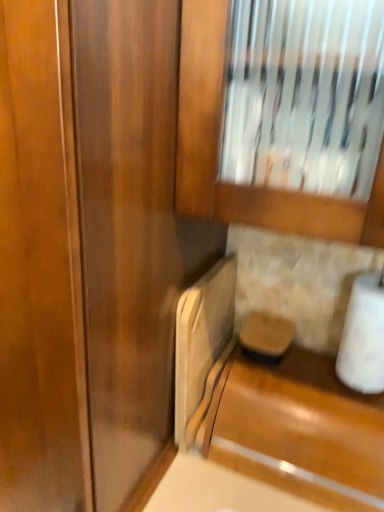
The height and width of the screenshot is (512, 384). I want to click on vacant space situated on the left part of white matte toilet paper at lower right, so click(303, 376).